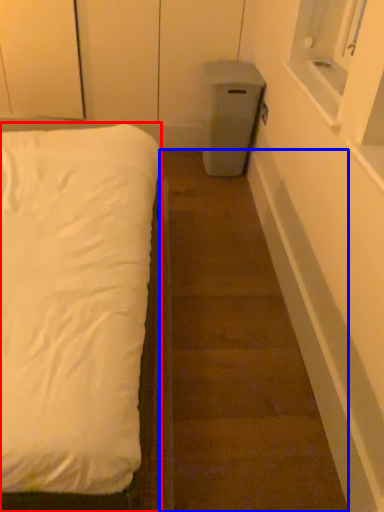
Question: Which object appears farthest to the camera in this image, bed (highlighted by a red box) or stairwell (highlighted by a blue box)?

Choices:
 (A) bed
 (B) stairwell

Answer: (B)